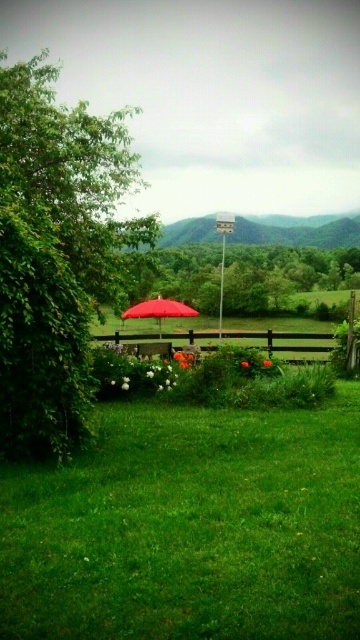
Which is behind, point (96, 298) or point (124, 314)?

Point (124, 314)

Is green leafy tree at left closer to the viewer compared to matte red umbrella at center?

That is True.

At what (x,y) coordinates should I click in order to perform the action: click on green leafy tree at left. Please return your answer as a coordinate pair (x, y). This screenshot has height=640, width=360. Looking at the image, I should click on (56, 253).

Between point (344, 285) and point (155, 300), which one is positioned behind?

Positioned behind is point (344, 285).

Which is below, green leafy tree at center or matte red umbrella at center?

matte red umbrella at center is lower down.

The width and height of the screenshot is (360, 640). What are the coordinates of `green leafy tree at center` in the screenshot? It's located at (x=282, y=276).

The height and width of the screenshot is (640, 360). I want to click on green leafy tree at center, so click(282, 276).

Does green leafy tree at left have a greater width compared to green leafy tree at center?

Yes.

Based on the photo, does green leafy tree at left come in front of green leafy tree at center?

Yes, it is in front of green leafy tree at center.

You are a GUI agent. You are given a task and a screenshot of the screen. Output one action in this format:
    pyautogui.click(x=<x>, y=<y>)
    Task: Click on the green leafy tree at left
    
    Given the screenshot: What is the action you would take?
    pyautogui.click(x=56, y=253)